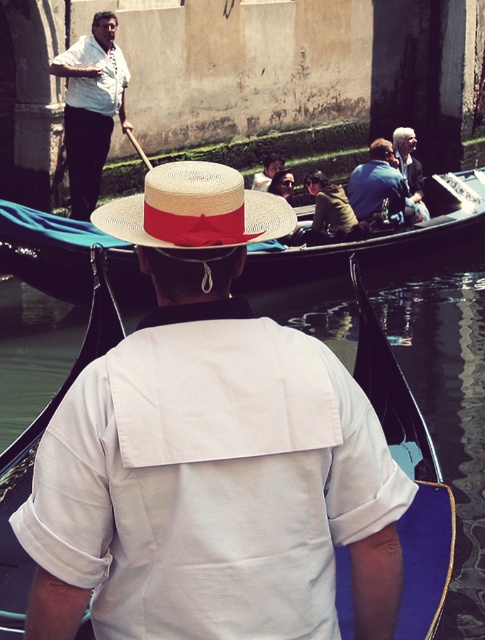
You are standing on the deck of a cruise ship and see the matte straw hat at center and the matte white shirt at upper left in the distance. If the cruise ship has a safety net that extends 5 meters from its edge, can you safely retrieve both items without stepping off the deck?

The matte straw hat at center is 5.31 meters from the matte white shirt at upper left. Since the safety net only extends 5 meters, you cannot safely retrieve the matte straw hat at center as it is beyond the net. However, the matte white shirt at upper left is within the 5 meter range and can be retrieved safely.

You are a photographer standing on a bridge overlooking the canal. You want to capture a photo of the white cotton shirt at center and the strawhat at center in the same frame. Given that your camera has a minimum focus distance of 5 feet, will both subjects be in focus?

The distance between the white cotton shirt at center and the strawhat at center is 6.48 feet, which exceeds the camera minimum focus distance of 5 feet. Therefore, both subjects will be in focus.